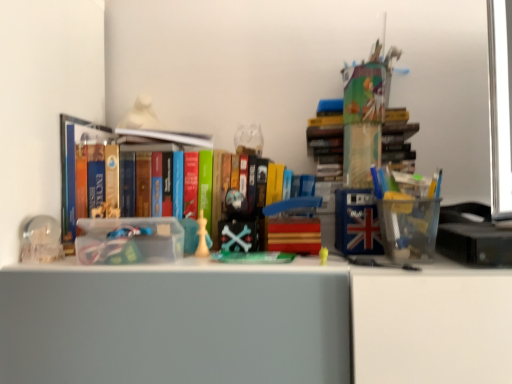
What do you see at coordinates (323, 256) in the screenshot? I see `yellow matte toy at center, positioned as the 5th toy in back-to-front order` at bounding box center [323, 256].

You are a GUI agent. You are given a task and a screenshot of the screen. Output one action in this format:
    pyautogui.click(x=<x>, y=<y>)
    Task: Click on the yellow matte toy at center, arranged as the 1th toy when viewed from the right
    This screenshot has width=512, height=384.
    Given the screenshot: What is the action you would take?
    coord(323,256)

In order to face matte yellow chess piece at center, the 3th toy positioned from the back, should I rotate leftwards or rightwards?

Turn left by 7.239 degrees to look at matte yellow chess piece at center, the 3th toy positioned from the back.

What do you see at coordinates (202, 237) in the screenshot? I see `matte yellow chess piece at center, marked as the fourth toy in a top-to-bottom arrangement` at bounding box center [202, 237].

Measure the distance between matte white bust at upper center, which ranks as the first toy in top-to-bottom order, and camera.

3.50 feet.

The height and width of the screenshot is (384, 512). What do you see at coordinates (237, 225) in the screenshot? I see `shiny plastic skull at center, positioned as the 4th toy in bottom-to-top order` at bounding box center [237, 225].

Measure the distance between clear plastic container at left and camera.

30.04 inches.

At what (x,y) coordinates should I click in order to perform the action: click on clear plastic container at left. Please return your answer as a coordinate pair (x, y). Looking at the image, I should click on coord(41,240).

At what (x,y) coordinates should I click in order to perform the action: click on yellow matte toy at center, positioned as the first toy in bottom-to-top order. Please return your answer as a coordinate pair (x, y). Looking at the image, I should click on (323, 256).

Is clear plastic container at left closer to the viewer compared to shiny plastic skull at center, the 3th toy positioned from the left?

Yes, the depth of clear plastic container at left is less than that of shiny plastic skull at center, the 3th toy positioned from the left.

Does point (56, 241) appear closer or farther from the camera than point (244, 210)?

Clearly, point (56, 241) is closer to the camera than point (244, 210).

From the image's perspective, is clear plastic container at left positioned above or below shiny plastic skull at center, the second toy viewed from the top?

Clearly, from the image's perspective, clear plastic container at left is below shiny plastic skull at center, the second toy viewed from the top.

From a real-world perspective, is matte yellow chess piece at center, marked as the fourth toy in a top-to-bottom arrangement, below matte white bust at upper center, which appears as the first toy when viewed from the left?

Yes, from a real-world perspective, matte yellow chess piece at center, marked as the fourth toy in a top-to-bottom arrangement, is beneath matte white bust at upper center, which appears as the first toy when viewed from the left.

Is matte yellow chess piece at center, the 3th toy positioned from the back, further to the viewer compared to matte white bust at upper center, which ranks as the first toy in top-to-bottom order?

No.

Which object is wider, matte yellow chess piece at center, acting as the 4th toy starting from the right, or matte white bust at upper center, which ranks as the first toy in top-to-bottom order?

matte white bust at upper center, which ranks as the first toy in top-to-bottom order.

Considering the points (205, 219) and (122, 124), which point is in front, point (205, 219) or point (122, 124)?

The point (205, 219) is more forward.

Can you tell me how much clear plastic container at left and matte white bust at upper center, arranged as the 1th toy when viewed from the back, differ in facing direction?

0.000698 degrees separate the facing orientations of clear plastic container at left and matte white bust at upper center, arranged as the 1th toy when viewed from the back.

From a real-world perspective, is clear plastic container at left positioned above or below matte white bust at upper center, which ranks as the first toy in top-to-bottom order?

clear plastic container at left is situated lower than matte white bust at upper center, which ranks as the first toy in top-to-bottom order, in the real world.

From the image's perspective, is clear plastic container at left on top of matte white bust at upper center, arranged as the 1th toy when viewed from the back?

No, from the image's perspective, clear plastic container at left is not above matte white bust at upper center, arranged as the 1th toy when viewed from the back.

Is the depth of clear plastic container at left greater than that of matte white bust at upper center, which is the 5th toy from front to back?

No, clear plastic container at left is closer to the viewer.

Can matte yellow chess piece at center, marked as the 2th toy in a bottom-to-top arrangement, be found inside yellow matte toy at center, arranged as the 1th toy when viewed from the right?

Actually, matte yellow chess piece at center, marked as the 2th toy in a bottom-to-top arrangement, is outside yellow matte toy at center, arranged as the 1th toy when viewed from the right.

Considering the positions of point (327, 248) and point (205, 232), is point (327, 248) closer or farther from the camera than point (205, 232)?

Point (327, 248) is farther from the camera than point (205, 232).

Considering their positions, is yellow matte toy at center, arranged as the 1th toy when viewed from the right, located in front of or behind matte yellow chess piece at center, the 3th toy positioned from the back?

Visually, yellow matte toy at center, arranged as the 1th toy when viewed from the right, is located in front of matte yellow chess piece at center, the 3th toy positioned from the back.

From a real-world perspective, who is located lower, yellow matte toy at center, arranged as the 1th toy when viewed from the right, or matte yellow chess piece at center, marked as the 2th toy in a bottom-to-top arrangement?

From a 3D spatial view, yellow matte toy at center, arranged as the 1th toy when viewed from the right, is below.

Does matte white bust at upper center, which is the 5th toy from front to back, touch matte yellow chess piece at center, the 2th toy positioned from the left?

No, matte white bust at upper center, which is the 5th toy from front to back, is not with matte yellow chess piece at center, the 2th toy positioned from the left.

Which is behind, matte white bust at upper center, the 5th toy ordered from the bottom, or matte yellow chess piece at center, marked as the fourth toy in a top-to-bottom arrangement?

matte white bust at upper center, the 5th toy ordered from the bottom.

From the picture: Considering the positions of objects matte white bust at upper center, arranged as the 5th toy when viewed from the right, and matte yellow chess piece at center, the third toy when ordered from front to back, in the image provided, who is more to the right, matte white bust at upper center, arranged as the 5th toy when viewed from the right, or matte yellow chess piece at center, the third toy when ordered from front to back,?

matte yellow chess piece at center, the third toy when ordered from front to back, is more to the right.

How different are the orientations of matte white bust at upper center, the 5th toy ordered from the bottom, and matte yellow chess piece at center, marked as the fourth toy in a top-to-bottom arrangement, in degrees?

The angle between the facing direction of matte white bust at upper center, the 5th toy ordered from the bottom, and the facing direction of matte yellow chess piece at center, marked as the fourth toy in a top-to-bottom arrangement, is 0.000237 degrees.

Is clear plastic container at left in contact with yellow matte toy at center, the 5th toy viewed from the top?

clear plastic container at left and yellow matte toy at center, the 5th toy viewed from the top, are clearly separated.

Which point is more distant from viewer, (25, 236) or (324, 254)?

Point (25, 236)

Looking at this image, which of these two, clear plastic container at left or yellow matte toy at center, the 5th toy viewed from the top, is thinner?

yellow matte toy at center, the 5th toy viewed from the top, is thinner.

Locate an element on the screen. This screenshot has height=384, width=512. the 1st toy to the right when counting from the white paper at center, marked as the 1th book in a top-to-bottom arrangement is located at coordinates (202, 237).

From the image's perspective, which is above, matte yellow chess piece at center, the third toy when ordered from front to back, or white paper at center, marked as the 1th book in a top-to-bottom arrangement?

From the image's view, white paper at center, marked as the 1th book in a top-to-bottom arrangement, is above.

How many degrees apart are the facing directions of matte yellow chess piece at center, marked as the 2th toy in a bottom-to-top arrangement, and white paper at center, acting as the second book starting from the bottom?

The angular difference between matte yellow chess piece at center, marked as the 2th toy in a bottom-to-top arrangement, and white paper at center, acting as the second book starting from the bottom, is 16.4 degrees.

The image size is (512, 384). I want to click on toy that is the 3rd one when counting rightward from the clear plastic container at left, so click(x=237, y=225).

The height and width of the screenshot is (384, 512). Identify the location of the 2nd toy in front of the matte white bust at upper center, the 5th toy ordered from the bottom, starting your count from the anchor. (202, 237).

When comparing their distances from matte yellow chess piece at center, the 3th toy positioned from the back, does white paper at center, acting as the second book starting from the bottom, or yellow matte toy at center, positioned as the 5th toy in back-to-front order, seem closer?

Among the two, white paper at center, acting as the second book starting from the bottom, is located nearer to matte yellow chess piece at center, the 3th toy positioned from the back.

Estimate the real-world distances between objects in this image. Which object is closer to wooden block at center, the fourth toy positioned from the back, shiny plastic skull at center, the 4th toy when ordered from front to back, or hardcover books at left, which is the 1th book in bottom-to-top order?

shiny plastic skull at center, the 4th toy when ordered from front to back.

From the image, which object appears to be nearer to clear plastic container at left, wooden block at center, the second toy positioned from the right, or shiny plastic skull at center, the 3th toy positioned from the left?

shiny plastic skull at center, the 3th toy positioned from the left.

Looking at this image, estimate the real-world distances between objects in this image. Which object is further from clear plastic container at left, shiny plastic skull at center, the 4th toy when ordered from front to back, or matte yellow chess piece at center, marked as the 2th toy in a bottom-to-top arrangement?

Based on the image, shiny plastic skull at center, the 4th toy when ordered from front to back, appears to be further to clear plastic container at left.

Considering their positions, is shiny plastic skull at center, positioned as the 4th toy in bottom-to-top order, positioned further to matte yellow chess piece at center, the third toy when ordered from front to back, than clear plastic container at left?

clear plastic container at left.

Considering their positions, is matte yellow chess piece at center, the 2th toy positioned from the left, positioned closer to yellow matte toy at center, arranged as the 1th toy when viewed from the right, than wooden block at center, placed as the 4th toy when sorted from left to right?

Among the two, wooden block at center, placed as the 4th toy when sorted from left to right, is located nearer to yellow matte toy at center, arranged as the 1th toy when viewed from the right.

Based on their spatial positions, is wooden block at center, placed as the 3th toy when sorted from top to bottom, or matte white bust at upper center, the 5th toy ordered from the bottom, further from clear plastic container at left?

wooden block at center, placed as the 3th toy when sorted from top to bottom, is further to clear plastic container at left.

Based on their spatial positions, is clear plastic container at left or wooden block at center, placed as the 4th toy when sorted from left to right, further from hardcover books at left, which is the 1th book in bottom-to-top order?

wooden block at center, placed as the 4th toy when sorted from left to right.

Locate an element on the screen. The image size is (512, 384). book located between hardcover books at left, which is the 1th book in bottom-to-top order, and matte white bust at upper center, arranged as the 1th toy when viewed from the back, in the depth direction is located at coordinates (163, 137).

At what (x,y) coordinates should I click in order to perform the action: click on book between clear plastic container at left and hardcover books at left, which is the 1th book in bottom-to-top order, from left to right. Please return your answer as a coordinate pair (x, y). The image size is (512, 384). Looking at the image, I should click on (163, 137).

Where is `toy situated between matte yellow chess piece at center, acting as the 4th toy starting from the right, and wooden block at center, the fourth toy positioned from the back, from left to right`? This screenshot has height=384, width=512. toy situated between matte yellow chess piece at center, acting as the 4th toy starting from the right, and wooden block at center, the fourth toy positioned from the back, from left to right is located at coordinates (237, 225).

Identify the location of book between white paper at center, marked as the 1th book in a top-to-bottom arrangement, and shiny plastic skull at center, positioned as the 2th toy in back-to-front order, in the vertical direction. This screenshot has width=512, height=384. (120, 174).